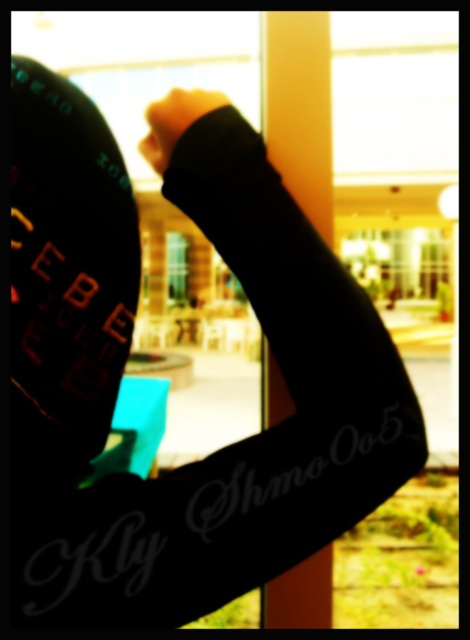
You are standing in a shopping mall and see a black matte hand at center and a clear glass window at center. Which object is located to the right side from your perspective?

The black matte hand at center is to the right of clear glass window at center.

You are standing in a modern indoor space with a clear glass window at center and a black matte hand at center. You want to touch the window to feel its surface. Which object should you reach for, and why?

You should reach for the clear glass window at center because the black matte hand at center is above it, meaning the window is lower and within reach.

You are a painter who needs to paint both the black matte hand at center and the clear glass window at center. Given their sizes, which object would require less paint?

The black matte hand at center has a smaller size compared to clear glass window at center, so it would require less paint.